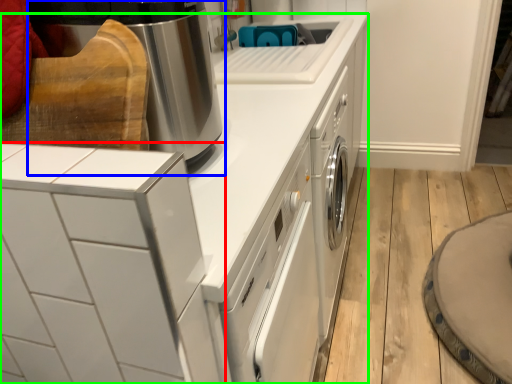
Question: Considering the real-world distances, which object is closest to home appliance (highlighted by a red box)? home appliance (highlighted by a blue box) or home appliance (highlighted by a green box).

Choices:
 (A) home appliance
 (B) home appliance

Answer: (B)